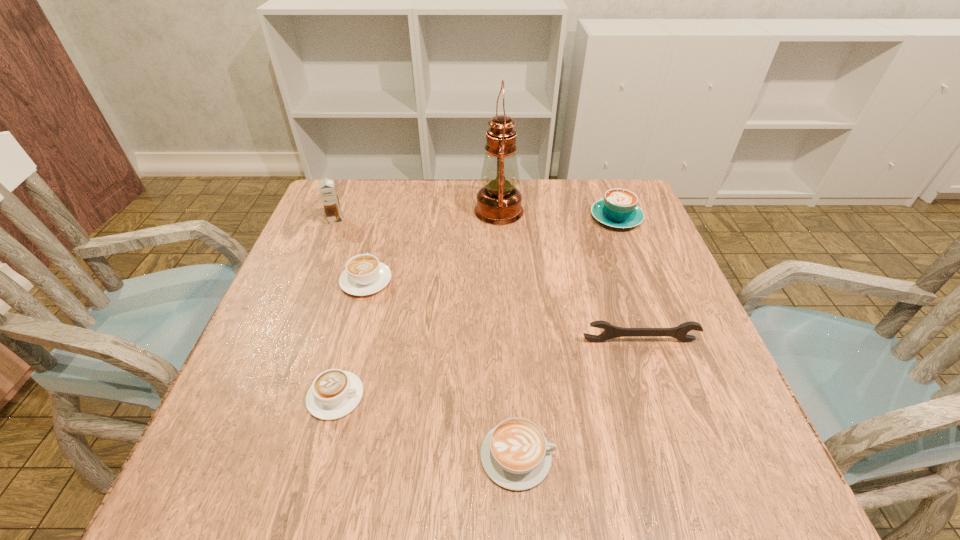
Identify the location of vacant space at the left edge of the desktop. (232, 394).

Where is `vacant space at the right edge`? vacant space at the right edge is located at coordinates (634, 236).

In the image, there is a desktop. Where is `vacant space at the far left corner`? This screenshot has height=540, width=960. vacant space at the far left corner is located at coordinates (339, 226).

Find the location of a particular element. This screenshot has width=960, height=540. free region at the near left corner of the desktop is located at coordinates (233, 478).

At what (x,y) coordinates should I click in order to perform the action: click on free space between the chocolate milk and the wrench. Please return your answer as a coordinate pair (x, y). Image resolution: width=960 pixels, height=540 pixels. Looking at the image, I should click on (488, 281).

Locate an element on the screen. This screenshot has height=540, width=960. free space between the third cappuccino from left to right and the third farthest cappuccino is located at coordinates (426, 426).

The image size is (960, 540). Find the location of `vacant space that's between the rightmost cappuccino and the tallest object`. vacant space that's between the rightmost cappuccino and the tallest object is located at coordinates coord(558,214).

Where is `free space that is in between the third nearest object and the nearest object`? free space that is in between the third nearest object and the nearest object is located at coordinates (579, 398).

This screenshot has width=960, height=540. In order to click on empty space between the leftmost object and the tallest object in this screenshot , I will do `click(418, 215)`.

Where is `vacant area that lies between the third cappuccino from left to right and the third nearest cappuccino`? This screenshot has width=960, height=540. vacant area that lies between the third cappuccino from left to right and the third nearest cappuccino is located at coordinates (442, 368).